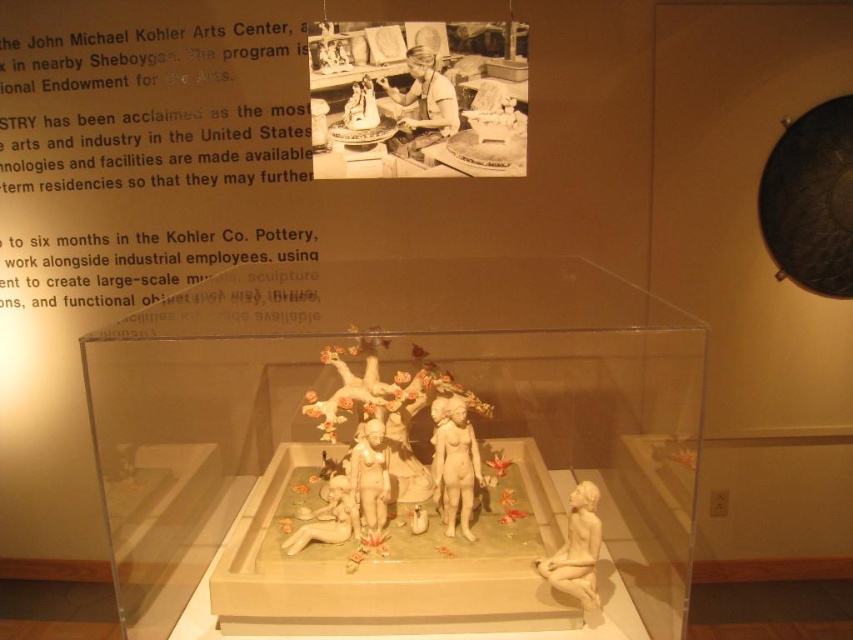
Who is taller, translucent glass sculpture at center or matte white statue at center?

translucent glass sculpture at center

Is point (387, 301) more distant than point (474, 461)?

Yes, it is behind point (474, 461).

The image size is (853, 640). Find the location of `translucent glass sculpture at center`. translucent glass sculpture at center is located at coordinates (393, 442).

Where is `white porcelain statue at center`? This screenshot has width=853, height=640. white porcelain statue at center is located at coordinates (369, 477).

How much distance is there between white porcelain statue at center and porcelain cherub at center?

white porcelain statue at center is 7.64 centimeters away from porcelain cherub at center.

Which is behind, point (379, 435) or point (352, 525)?

The point (352, 525) is behind.

Locate an element on the screen. The image size is (853, 640). white porcelain statue at center is located at coordinates (369, 477).

This screenshot has width=853, height=640. In order to click on translucent glass sculpture at center in this screenshot , I will do `click(393, 442)`.

Can you confirm if translucent glass sculpture at center is shorter than white porcelain statue at center?

Result: In fact, translucent glass sculpture at center may be taller than white porcelain statue at center.

Find the location of a particular element. The width and height of the screenshot is (853, 640). translucent glass sculpture at center is located at coordinates (393, 442).

Locate an element on the screen. translucent glass sculpture at center is located at coordinates (393, 442).